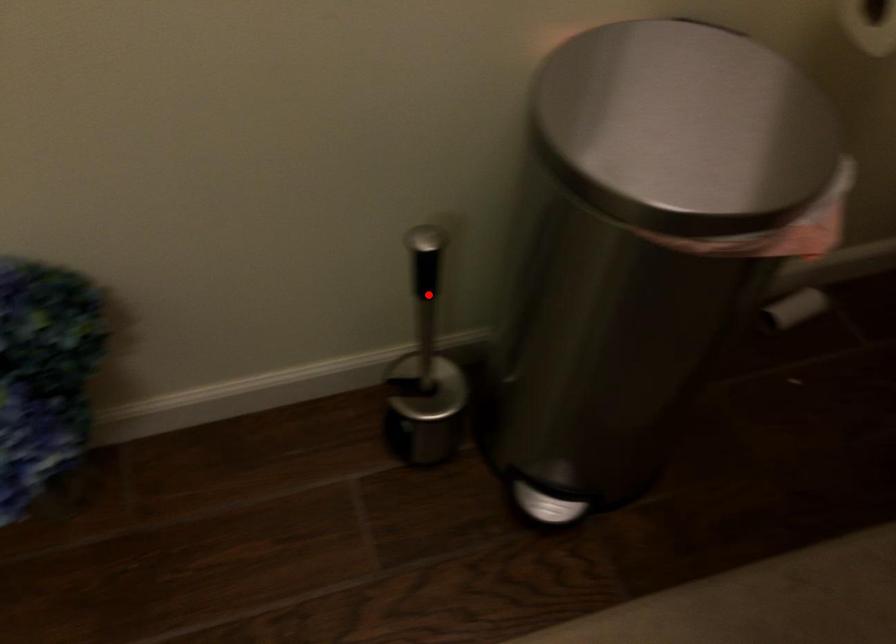
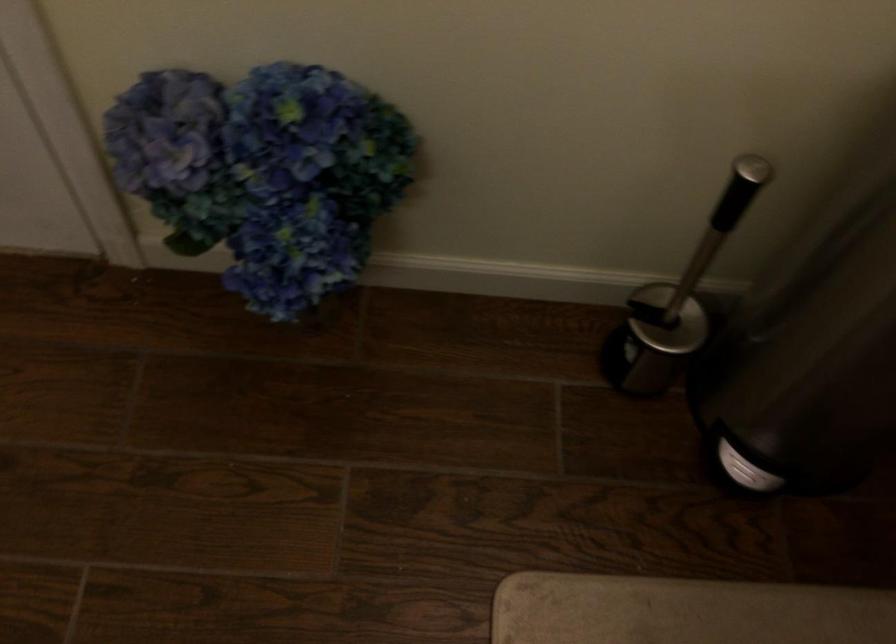
Where in the second image is the point corresponding to the highlighted location from the first image?

(719, 225)